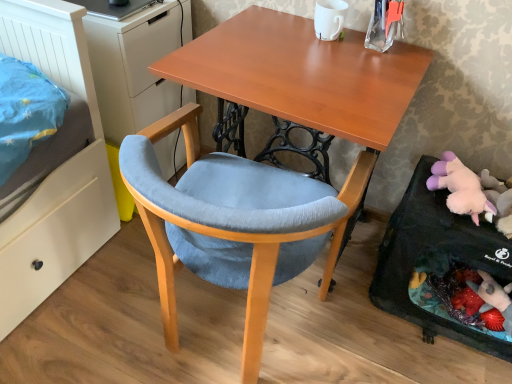
The image size is (512, 384). Find the location of `blank space situated above wooden desk at center (from a real-world perspective)`. blank space situated above wooden desk at center (from a real-world perspective) is located at coordinates (303, 68).